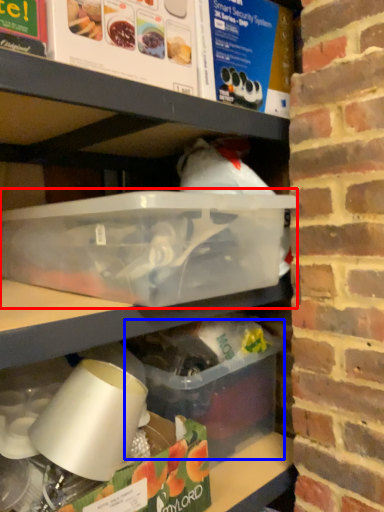
Question: Which object appears farthest to the camera in this image, box (highlighted by a red box) or box (highlighted by a blue box)?

Choices:
 (A) box
 (B) box

Answer: (B)